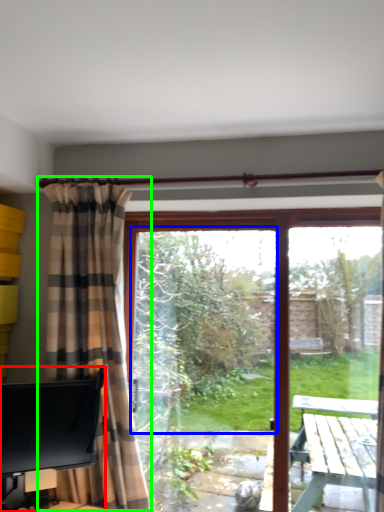
Question: Based on their relative distances, which object is farther from desk (highlighted by a red box)? Choose from window screen (highlighted by a blue box) and curtain (highlighted by a green box).

Choices:
 (A) window screen
 (B) curtain

Answer: (A)